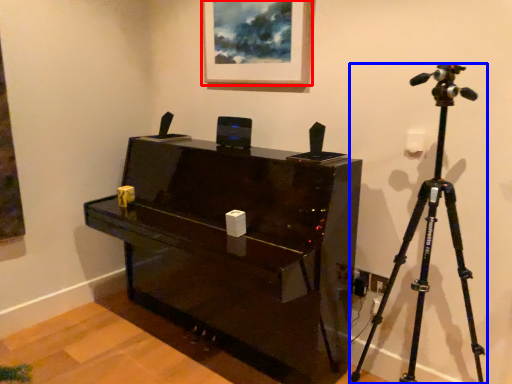
Question: Which point is further to the camera, picture frame (highlighted by a red box) or tripod (highlighted by a blue box)?

Choices:
 (A) picture frame
 (B) tripod

Answer: (A)